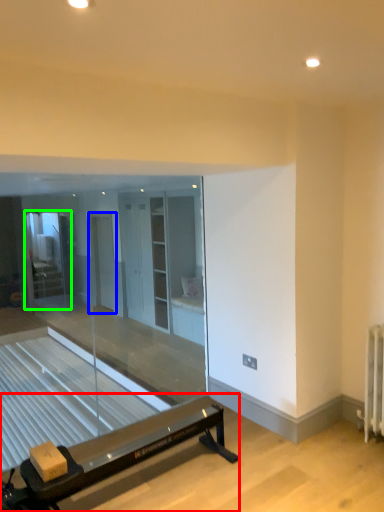
Question: Based on their relative distances, which object is farther from furniture (highlighted by a red box)? Choose from screen door (highlighted by a blue box) and glass door (highlighted by a green box).

Choices:
 (A) screen door
 (B) glass door

Answer: (B)